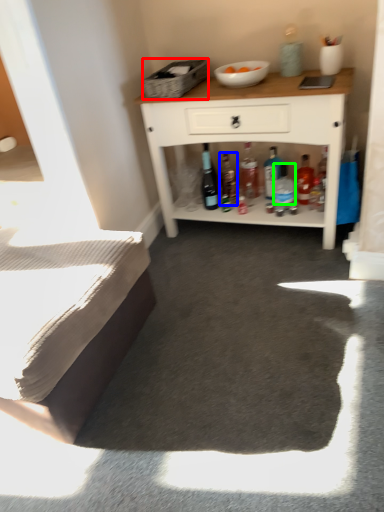
Question: Which is farther away from picnic basket (highlighted by a red box)? bottle (highlighted by a blue box) or bottle (highlighted by a green box)?

Choices:
 (A) bottle
 (B) bottle

Answer: (B)